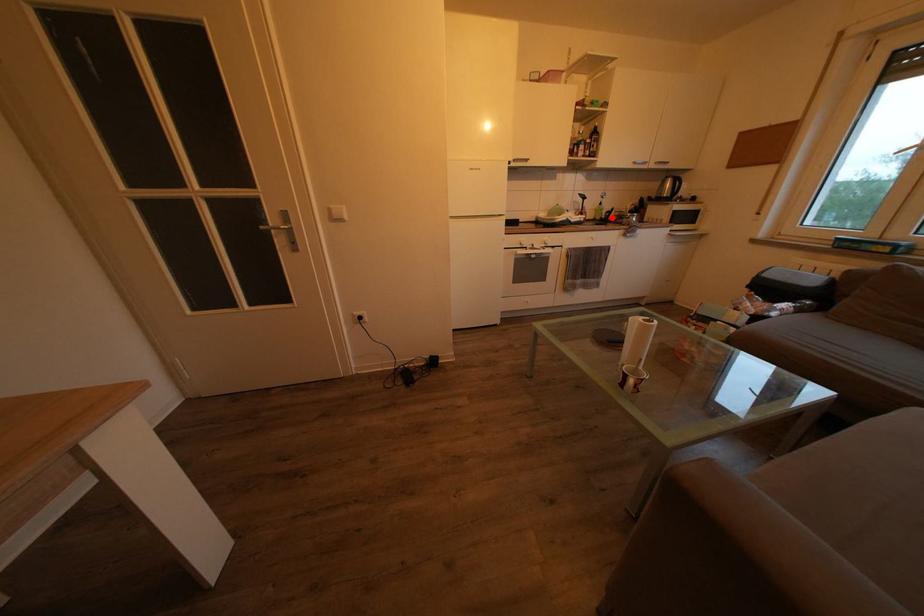
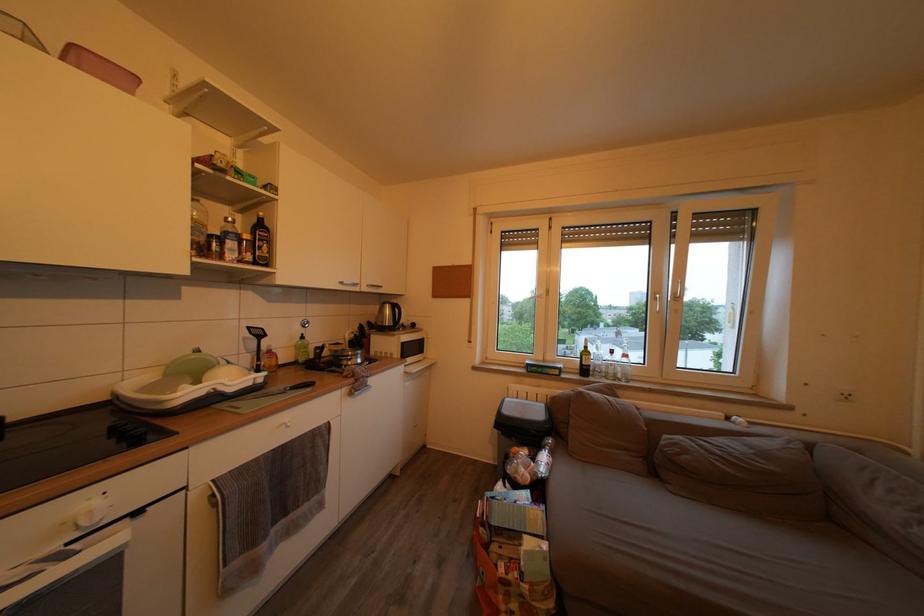
Where in the second image is the point corresponding to the highlighted location from the first image?

(320, 353)